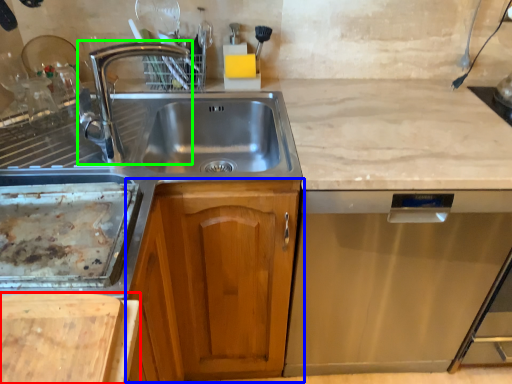
Question: Which is nearer to the cutting board (highlighted by a red box)? cabinetry (highlighted by a blue box) or tap (highlighted by a green box).

Choices:
 (A) cabinetry
 (B) tap

Answer: (A)